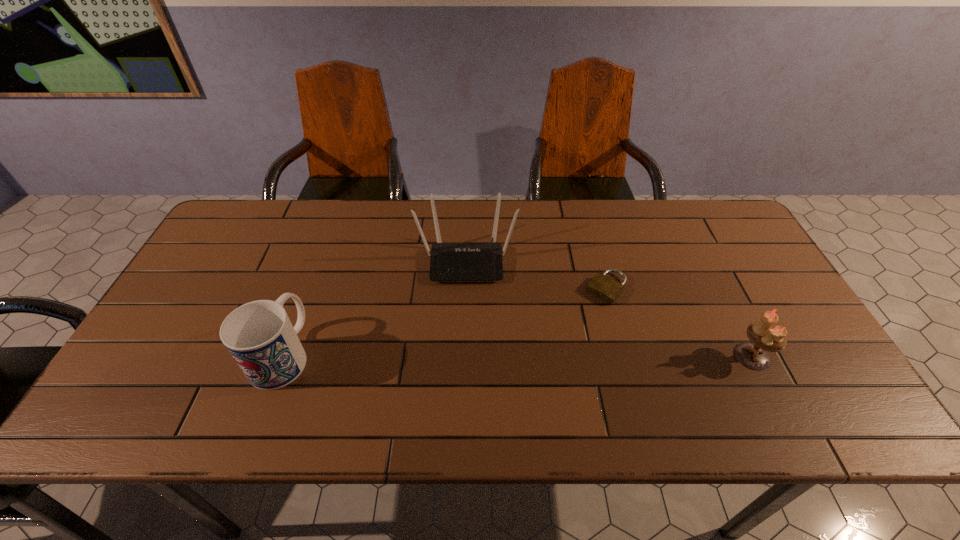
In the image, there is a desktop. Where is `free space at the left edge`? The height and width of the screenshot is (540, 960). free space at the left edge is located at coordinates (150, 353).

At what (x,y) coordinates should I click in order to perform the action: click on vacant space at the far right corner of the desktop. Please return your answer as a coordinate pair (x, y). This screenshot has width=960, height=540. Looking at the image, I should click on (711, 239).

Locate an element on the screen. free space between the third object from left to right and the leftmost object is located at coordinates tap(444, 321).

The width and height of the screenshot is (960, 540). I want to click on free space between the router and the rightmost object, so click(x=610, y=308).

Identify the location of free space between the leftmost object and the router. This screenshot has width=960, height=540. (374, 307).

Find the location of a particular element. The width and height of the screenshot is (960, 540). free space between the mug and the rightmost object is located at coordinates coord(516,355).

Image resolution: width=960 pixels, height=540 pixels. Find the location of `vacant space that is in between the padlock and the mug`. vacant space that is in between the padlock and the mug is located at coordinates (444, 321).

Where is `free space between the rightmost object and the leftmost object`? This screenshot has height=540, width=960. free space between the rightmost object and the leftmost object is located at coordinates (x=516, y=355).

The height and width of the screenshot is (540, 960). What are the coordinates of `vacant area that lies between the candle holder and the router` in the screenshot? It's located at (610, 308).

Where is `vacant area that lies between the second object from left to right and the mug`? The height and width of the screenshot is (540, 960). vacant area that lies between the second object from left to right and the mug is located at coordinates (374, 307).